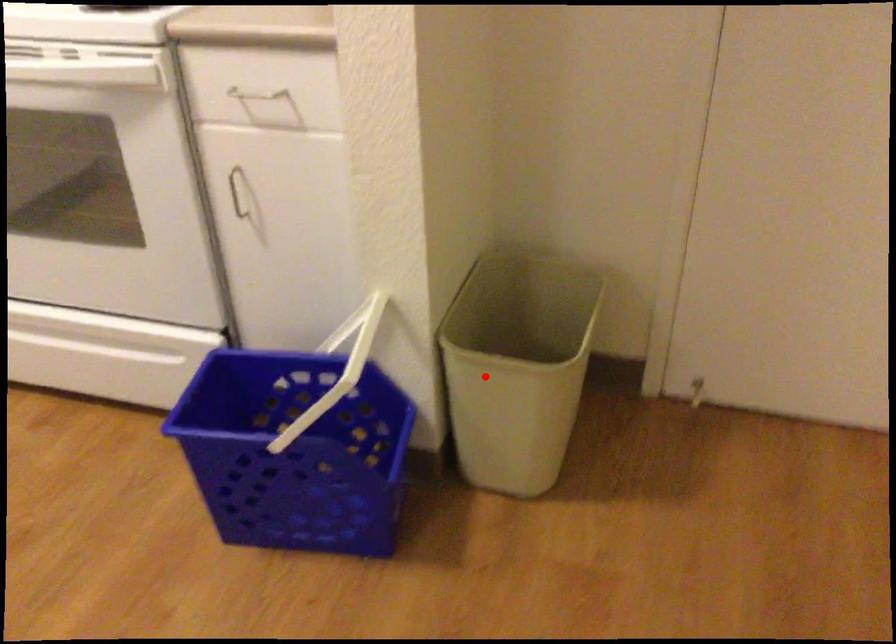
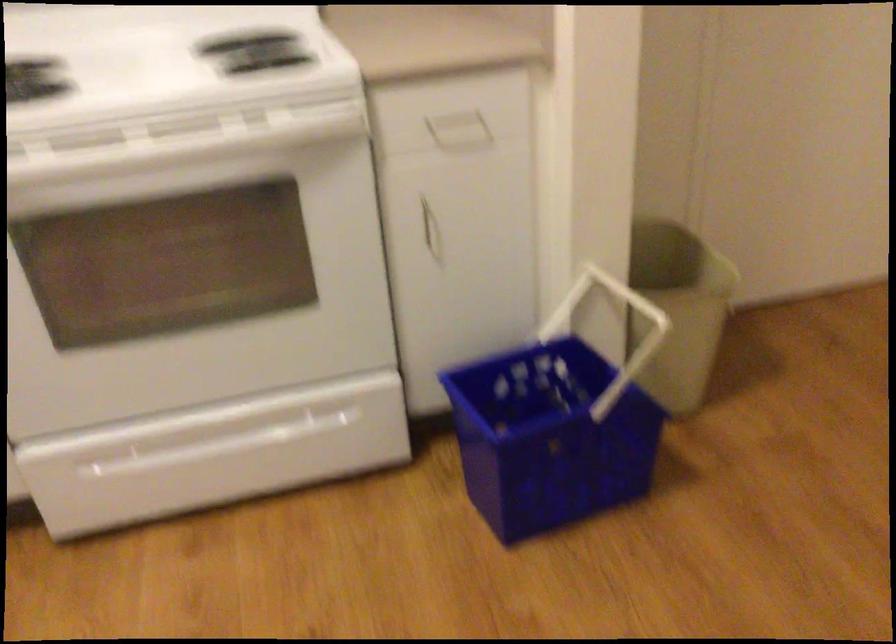
Question: I am providing you with two images of the same scene from different viewpoints. In image1, a red point is highlighted. Considering the same 3D point in image2, which of the following is correct?

Choices:
 (A) It is closer
 (B) It is farther

Answer: (B)